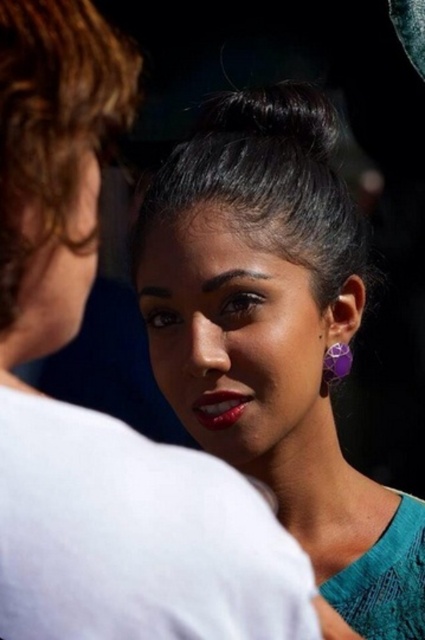
Question: Among these points, which one is nearest to the camera?

Choices:
 (A) (73, 100)
 (B) (306, 154)

Answer: (A)

Question: Can you confirm if teal fabric dress at center is smaller than shiny red lipstick at lower center?

Choices:
 (A) yes
 (B) no

Answer: (B)

Question: Considering the relative positions of curly brown hair at left and purple glass earring at lower right in the image provided, where is curly brown hair at left located with respect to purple glass earring at lower right?

Choices:
 (A) right
 (B) left

Answer: (B)

Question: Which object is the farthest from the teal fabric dress at center?

Choices:
 (A) black shiny hair at center
 (B) purple glass earring at lower right

Answer: (B)

Question: Is shiny red lipstick at lower center to the left of purple glass earring at lower right from the viewer's perspective?

Choices:
 (A) no
 (B) yes

Answer: (B)

Question: Which point appears closest to the camera in this image?

Choices:
 (A) (173, 316)
 (B) (223, 417)
 (C) (27, 38)

Answer: (C)